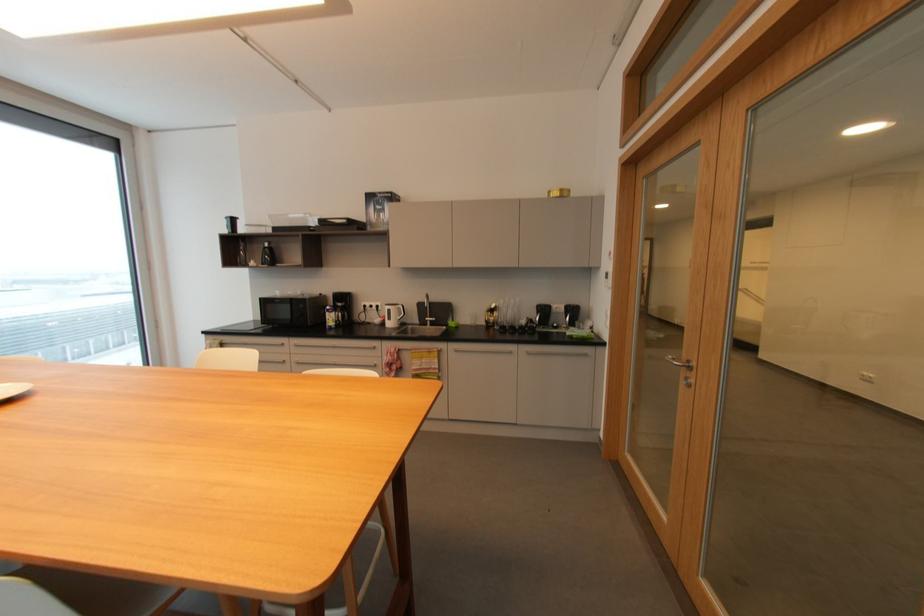
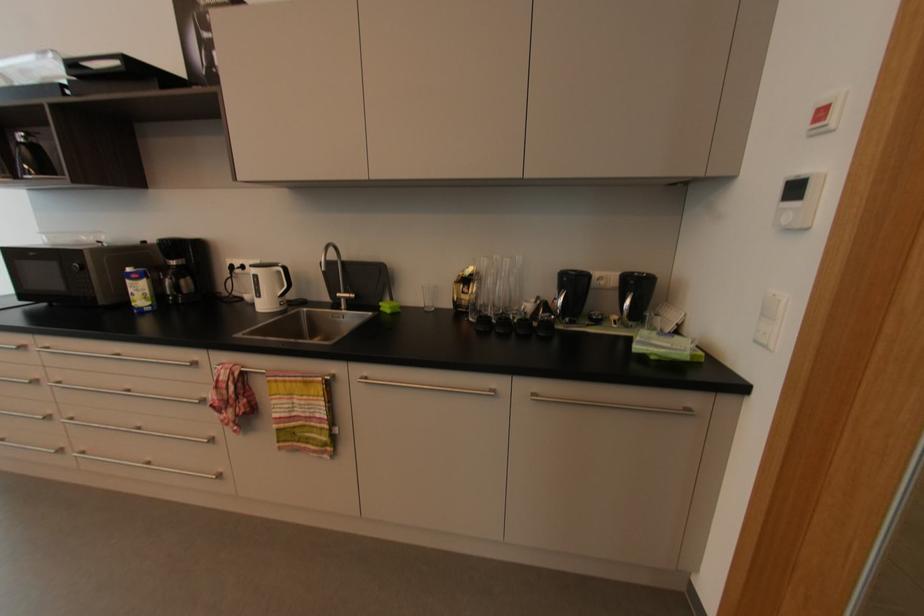
The point at (434, 322) is marked in the first image. Where is the corresponding point in the second image?

(350, 300)